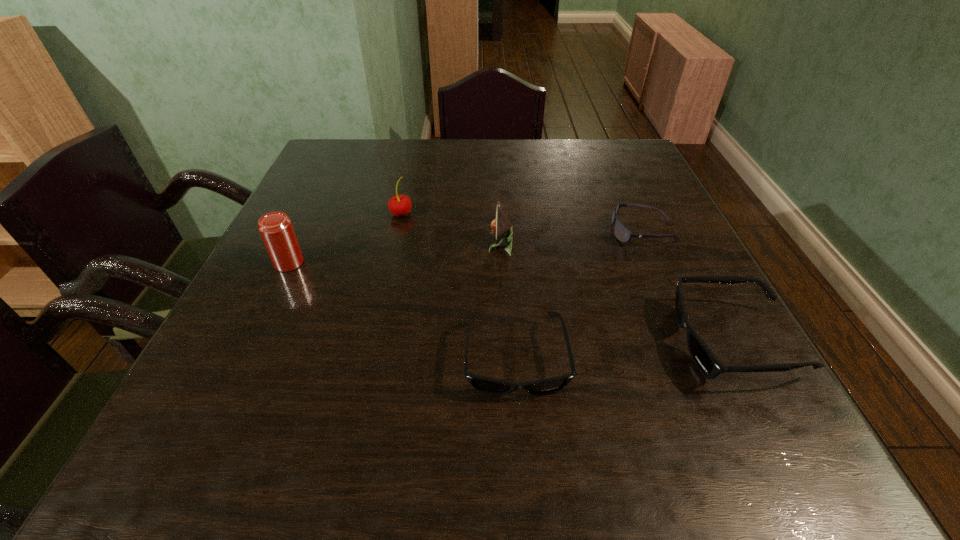
Find the location of a particular element. The image size is (960, 540). vacant space positioned on the front-facing side of the tallest sunglasses is located at coordinates (554, 342).

At what (x,y) coordinates should I click in order to perform the action: click on vacant region located on the back of the fifth object from right to left. Please return your answer as a coordinate pair (x, y). The image size is (960, 540). Looking at the image, I should click on (414, 159).

Where is `vacant space located 0.330m on the seed side of the avocado`? The width and height of the screenshot is (960, 540). vacant space located 0.330m on the seed side of the avocado is located at coordinates (343, 245).

The image size is (960, 540). I want to click on free space located 0.330m on the seed side of the avocado, so click(x=343, y=245).

Locate an element on the screen. free spot located 0.240m on the seed side of the avocado is located at coordinates (383, 245).

This screenshot has width=960, height=540. Find the location of `vacant space located on the right of the beer can`. vacant space located on the right of the beer can is located at coordinates (428, 263).

I want to click on free region located 0.330m on the lenses of the shortest object, so click(x=470, y=232).

This screenshot has height=540, width=960. I want to click on vacant space positioned 0.330m on the lenses of the shortest object, so click(x=470, y=232).

The width and height of the screenshot is (960, 540). In order to click on vacant position located on the lenses of the shortest object in this screenshot , I will do `click(569, 232)`.

At what (x,y) coordinates should I click in order to perform the action: click on object that is at the left edge. Please return your answer as a coordinate pair (x, y). Looking at the image, I should click on (276, 229).